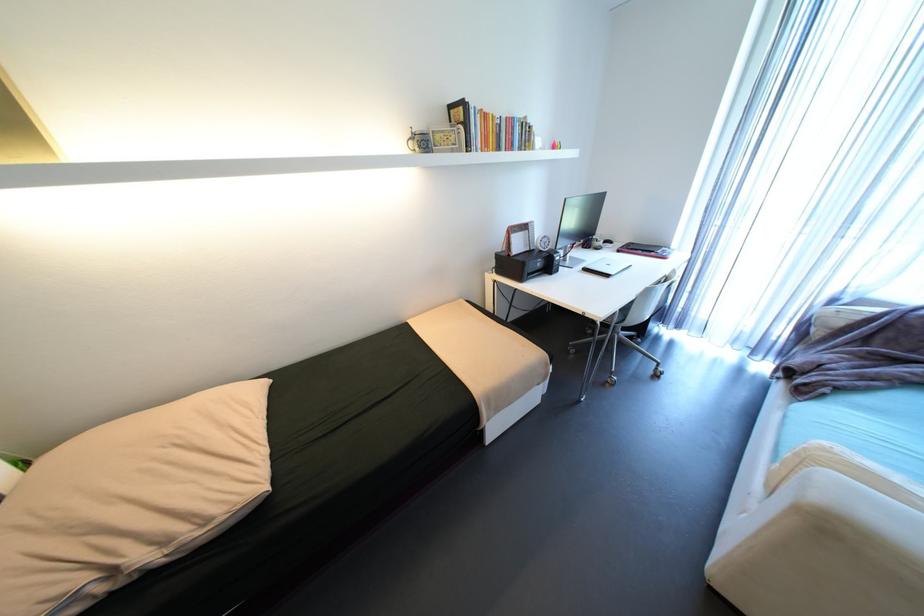
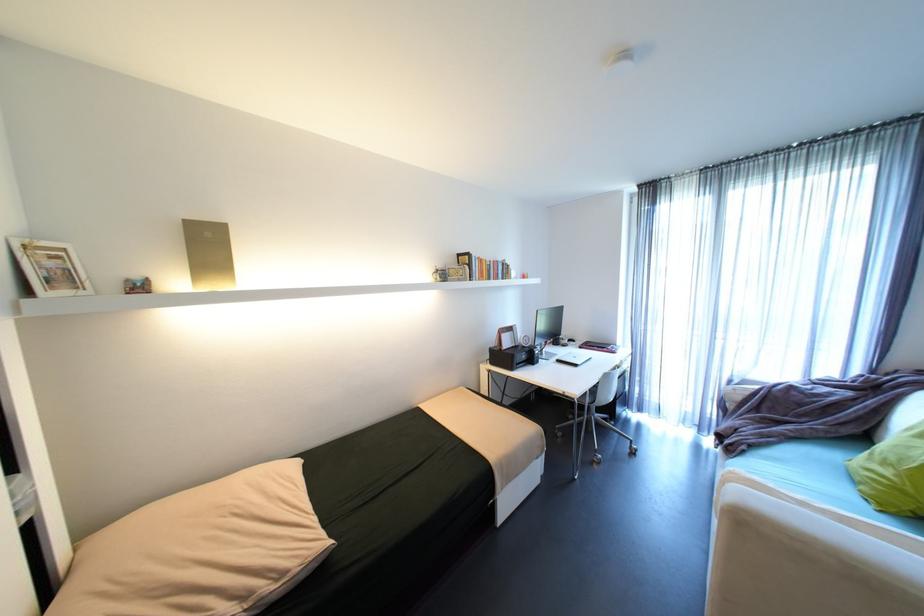
Where in the second image is the point corresponding to point 827,468 from the first image?

(737, 485)